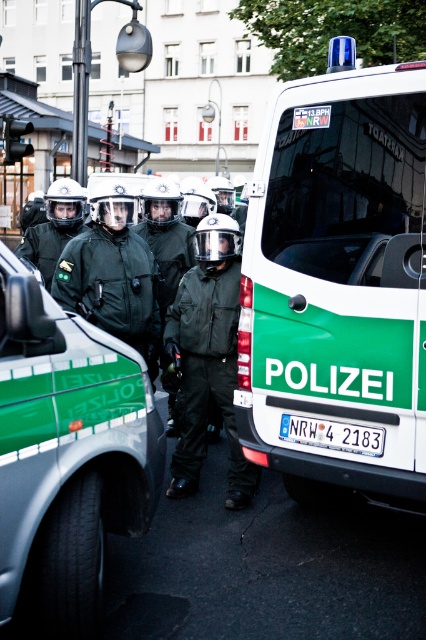
You are a pedestrian trying to cross the street and see the green matte van at center and the matte black uniform at center. Which object is closer to your right side?

The green matte van at center is positioned on the right side of matte black uniform at center, so the green matte van at center is closer to your right side.

You are a delivery person trying to navigate through the scene. The green matte van at center and the matte black uniform at center are blocking your path. Which object should you move around to pass through the area safely?

The green matte van at center might be wider than the matte black uniform at center, so you should move around the green matte van at center to pass through the area safely.

Looking at this image, you are a pedestrian observing the scene from the sidewalk. You see the green matte van at center and the green matte uniform at center. Which object is closer to you?

The green matte van at center is closer to you because it is in front of the green matte uniform at center.